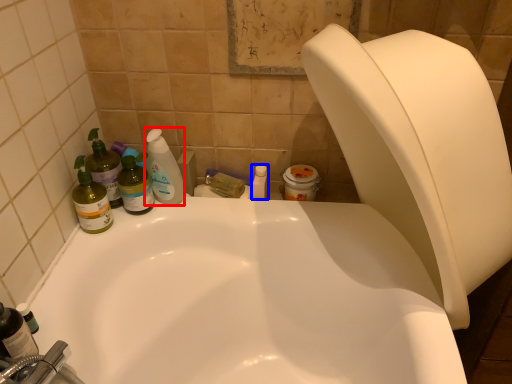
Question: Which of the following is the farthest to the observer, cleaning product (highlighted by a red box) or toiletry (highlighted by a blue box)?

Choices:
 (A) cleaning product
 (B) toiletry

Answer: (B)